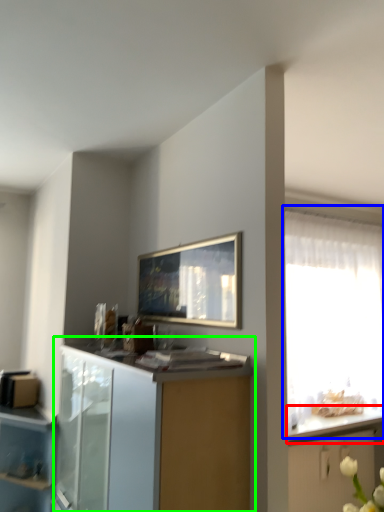
Question: Which object is positioned closest to countertop (highlighted by a red box)? Select from window (highlighted by a blue box) and cabinetry (highlighted by a green box).

Choices:
 (A) window
 (B) cabinetry

Answer: (A)